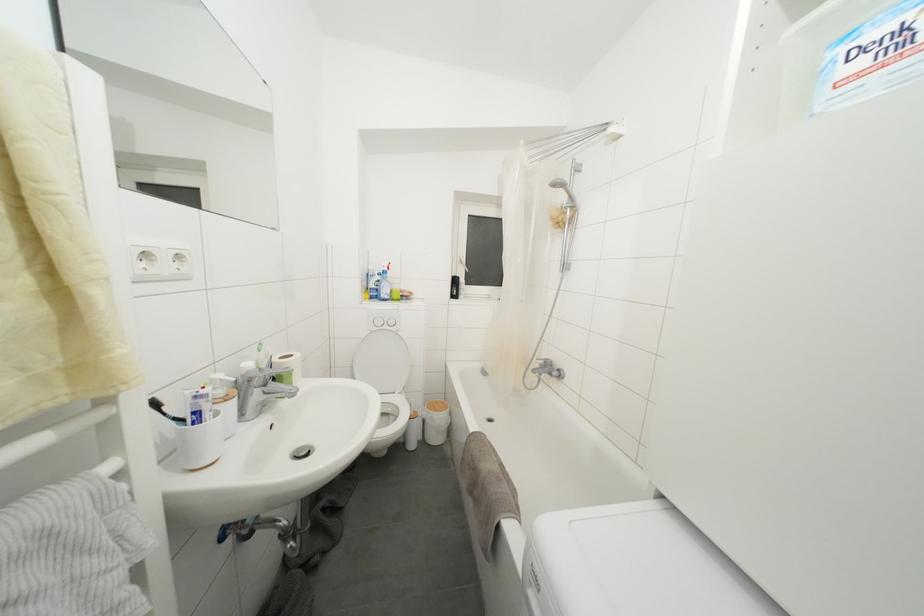
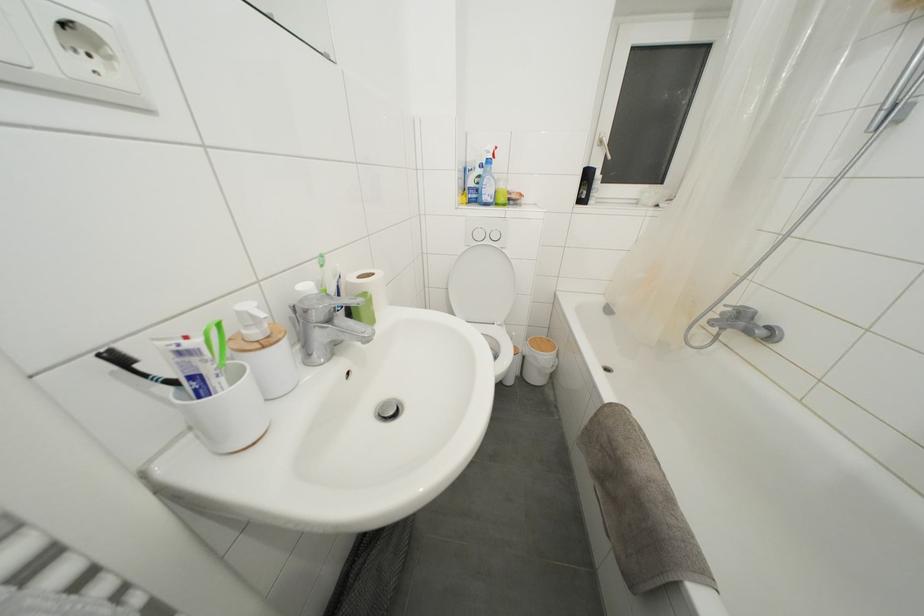
Which direction would the cameraman need to move to produce the second image?

The cameraman walked toward left, forward.